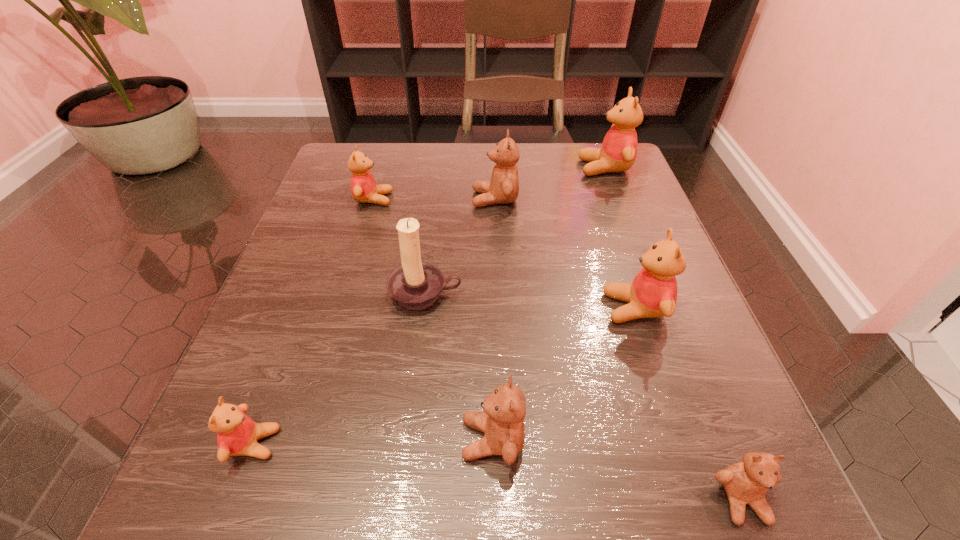
Identify the location of free space between the second smallest brown teddy bear and the smallest red teddy bear. (373, 441).

Image resolution: width=960 pixels, height=540 pixels. I want to click on vacant space that's between the smallest brown teddy bear and the second biggest red teddy bear, so click(688, 404).

The image size is (960, 540). I want to click on vacant space that is in between the sixth object from right to left and the smallest brown teddy bear, so click(584, 397).

Where is `vacant region between the biggest brown teddy bear and the rightmost brown teddy bear`? Image resolution: width=960 pixels, height=540 pixels. vacant region between the biggest brown teddy bear and the rightmost brown teddy bear is located at coordinates (618, 349).

The image size is (960, 540). Identify the location of vacant area between the farthest red teddy bear and the rightmost brown teddy bear. (673, 334).

Where is `free point between the smallest red teddy bear and the second smallest brown teddy bear`? This screenshot has height=540, width=960. free point between the smallest red teddy bear and the second smallest brown teddy bear is located at coordinates (373, 441).

This screenshot has width=960, height=540. What are the coordinates of `object that is the closest to the smallest brown teddy bear` in the screenshot? It's located at (653, 293).

Find the location of a particular element. object that is the nearest to the farthest brown teddy bear is located at coordinates (618, 152).

This screenshot has width=960, height=540. In order to click on teddy bear that stands as the closest to the nearest red teddy bear in this screenshot , I will do `click(502, 421)`.

Where is `teddy bear that stands as the third closest to the biggest brown teddy bear`? teddy bear that stands as the third closest to the biggest brown teddy bear is located at coordinates [x=653, y=293].